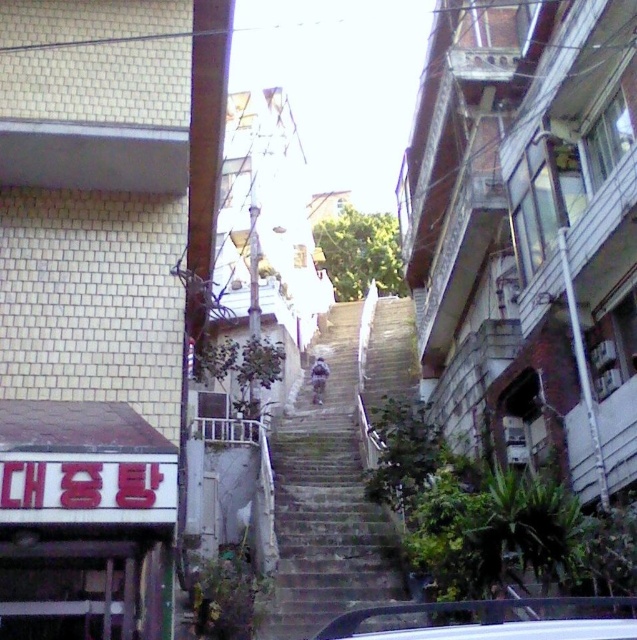
Does gray concrete stairs at center have a lesser height compared to white plastic balustrade at center?

No.

Does gray concrete stairs at center have a lesser width compared to white plastic balustrade at center?

No, gray concrete stairs at center is not thinner than white plastic balustrade at center.

Which is in front, point (380, 582) or point (236, 429)?

Point (380, 582) is in front.

Image resolution: width=637 pixels, height=640 pixels. Identify the location of gray concrete stairs at center. (326, 502).

Based on the photo, which is above, gray concrete stairs at center or white glossy car at center?

Positioned higher is white glossy car at center.

Can you confirm if gray concrete stairs at center is positioned to the right of white glossy car at center?

Incorrect, gray concrete stairs at center is not on the right side of white glossy car at center.

Identify the location of gray concrete stairs at center. The width and height of the screenshot is (637, 640). (326, 502).

Find the location of a particular element. gray concrete stairs at center is located at coordinates (326, 502).

Which is above, white glossy car at center or white plastic balustrade at center?

Positioned higher is white glossy car at center.

Is white glossy car at center bigger than white plastic balustrade at center?

Incorrect, white glossy car at center is not larger than white plastic balustrade at center.

Is point (452, 611) farther from viewer compared to point (229, 435)?

No.

Find the location of `white glossy car at center`. white glossy car at center is located at coordinates (461, 609).